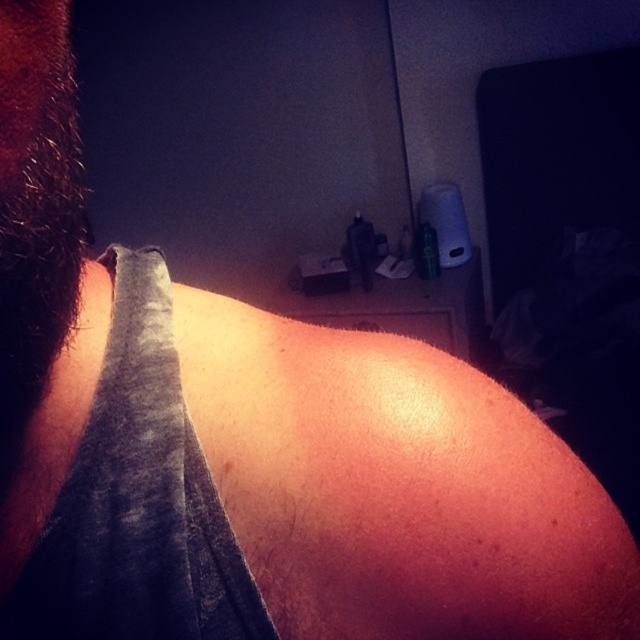
Question: Which point appears farthest from the camera in this image?

Choices:
 (A) (81, 323)
 (B) (76, 458)

Answer: (A)

Question: Is gray cotton shirt at left positioned behind hairy skin at left?

Choices:
 (A) yes
 (B) no

Answer: (B)

Question: Can you confirm if gray cotton shirt at left is wider than hairy skin at left?

Choices:
 (A) no
 (B) yes

Answer: (B)

Question: Can you confirm if gray cotton shirt at left is positioned to the right of hairy skin at left?

Choices:
 (A) no
 (B) yes

Answer: (B)